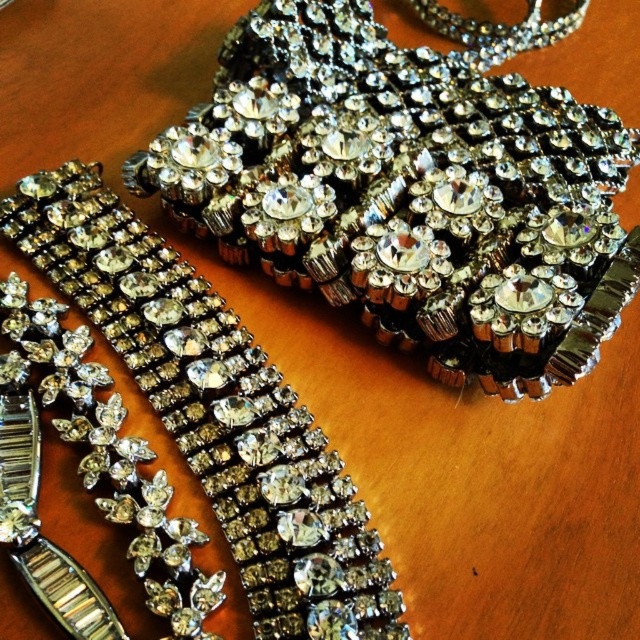
You are a customer looking to purchase a necklace and a belt. You see the clear crystal rhinestone belt at upper center and the clear crystal necklace at lower left. Which one is closer to you?

The clear crystal rhinestone belt at upper center is closer to you because it is further to the viewer than the clear crystal necklace at lower left.

You are a jeweler examining the clear crystal rhinestone belt at upper center. What is the exact coordinate position of this belt?

The clear crystal rhinestone belt at upper center is located at point (x=408, y=193).

You are a jewelry designer examining the image. You need to decide which piece to place in a display case that has a width limit of 5 cm. The clear crystal bracelet at center and the clear crystal necklace at lower left are both candidates. Based on their widths, which one is more likely to fit?

The clear crystal bracelet at center might be wider than the clear crystal necklace at lower left, so the necklace is more likely to fit within the 5 cm width limit.